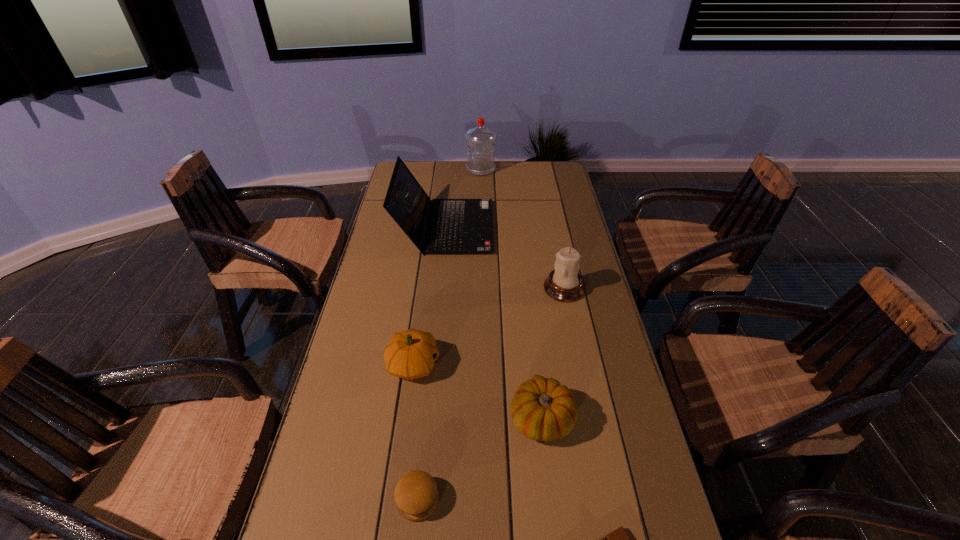
You are a GUI agent. You are given a task and a screenshot of the screen. Output one action in this format:
    pyautogui.click(x=<x>, y=<y>)
    Task: Click on the farthest object
    The width and height of the screenshot is (960, 540).
    Given the screenshot: What is the action you would take?
    pyautogui.click(x=481, y=161)

The height and width of the screenshot is (540, 960). Find the location of `the sixth nearest object`. the sixth nearest object is located at coordinates (460, 226).

Locate an element on the screen. Image resolution: width=960 pixels, height=540 pixels. the third tallest object is located at coordinates (564, 284).

What are the coordinates of `candle holder` in the screenshot? It's located at (564, 284).

Find the location of a particular element. This screenshot has height=540, width=960. the fourth shortest object is located at coordinates (410, 354).

In order to click on the farther gourd in this screenshot , I will do 410,354.

The height and width of the screenshot is (540, 960). Find the location of `the nearer gourd`. the nearer gourd is located at coordinates (542, 409).

I want to click on the fifth farthest object, so click(542, 409).

The image size is (960, 540). I want to click on the sixth farthest object, so click(x=416, y=495).

I want to click on hamburger, so click(x=416, y=495).